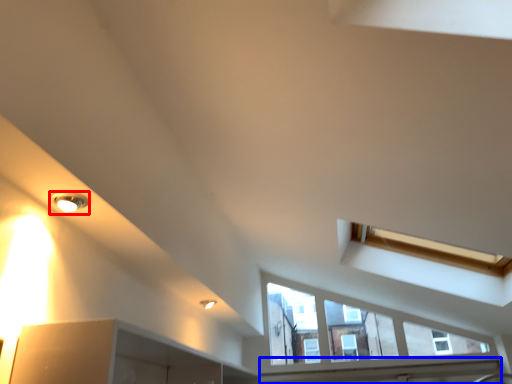
Question: Which object is closer to the camera taking this photo, light fixture (highlighted by a red box) or window sill (highlighted by a blue box)?

Choices:
 (A) light fixture
 (B) window sill

Answer: (A)